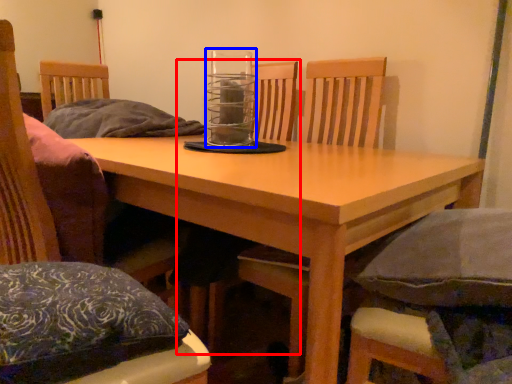
Question: Which of the following is the closest to the observer, armchair (highlighted by a red box) or glass jar (highlighted by a blue box)?

Choices:
 (A) armchair
 (B) glass jar

Answer: (B)